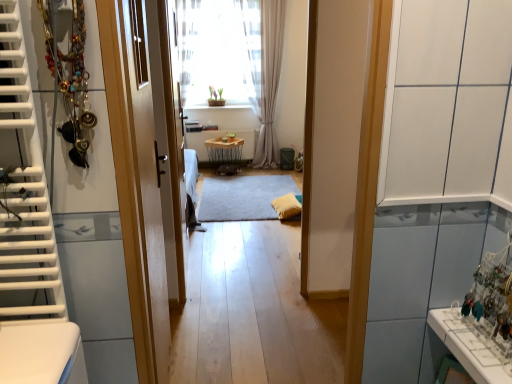
Locate an element on the screen. empty space that is to the right of transparent plastic screen door at center is located at coordinates (237, 267).